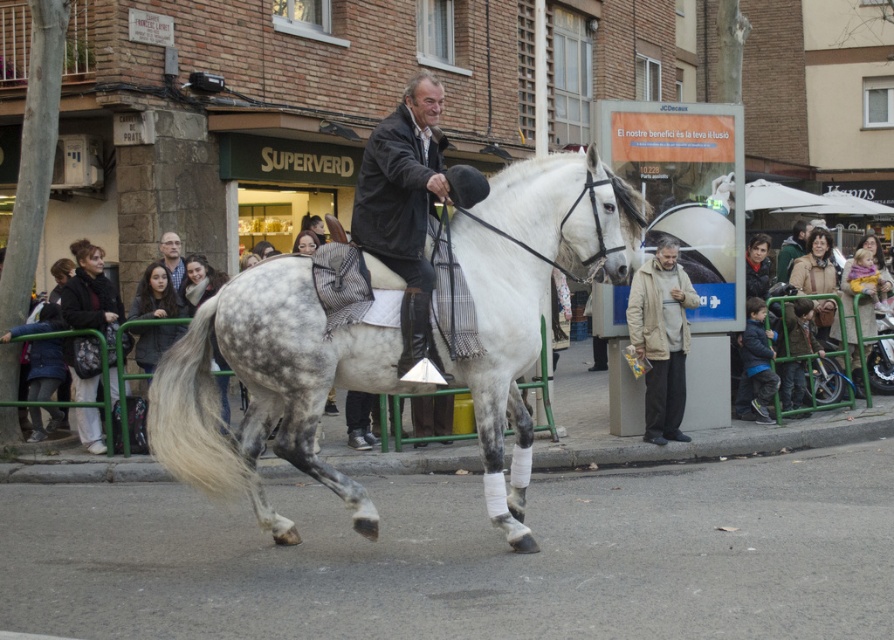
Is dark brown leather jacket at center above dark blue jacket at lower right?

Correct, dark brown leather jacket at center is located above dark blue jacket at lower right.

Measure the distance between dark brown leather jacket at center and dark blue jacket at lower right.

dark brown leather jacket at center and dark blue jacket at lower right are 5.75 meters apart from each other.

Locate an element on the screen. The height and width of the screenshot is (640, 894). dark brown leather jacket at center is located at coordinates (403, 208).

Which is in front, point (89, 420) or point (769, 381)?

Point (89, 420) is more forward.

Who is lower down, dark gray scarf at left or dark blue jacket at lower right?

Positioned lower is dark blue jacket at lower right.

Is point (85, 305) positioned before point (746, 333)?

Yes.

This screenshot has width=894, height=640. I want to click on dark gray scarf at left, so click(x=93, y=301).

Who is positioned more to the right, beige fabric jacket at right or dark blue jacket at lower right?

dark blue jacket at lower right

This screenshot has width=894, height=640. What do you see at coordinates (661, 337) in the screenshot? I see `beige fabric jacket at right` at bounding box center [661, 337].

Locate an element on the screen. The height and width of the screenshot is (640, 894). beige fabric jacket at right is located at coordinates (661, 337).

Where is `beige fabric jacket at right`? This screenshot has width=894, height=640. beige fabric jacket at right is located at coordinates (661, 337).